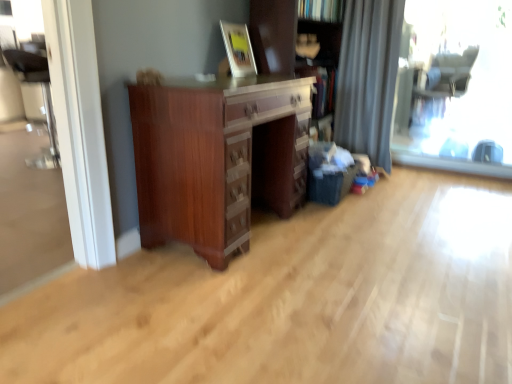
Question: Considering the relative sizes of transparent glass window at right and wooden picture frame at upper center in the image provided, is transparent glass window at right bigger than wooden picture frame at upper center?

Choices:
 (A) no
 (B) yes

Answer: (B)

Question: Are transparent glass window at right and wooden picture frame at upper center located far from each other?

Choices:
 (A) yes
 (B) no

Answer: (A)

Question: Can you confirm if transparent glass window at right is positioned to the right of wooden picture frame at upper center?

Choices:
 (A) yes
 (B) no

Answer: (A)

Question: From the image's perspective, is transparent glass window at right below wooden picture frame at upper center?

Choices:
 (A) no
 (B) yes

Answer: (B)

Question: Is transparent glass window at right smaller than wooden picture frame at upper center?

Choices:
 (A) yes
 (B) no

Answer: (B)

Question: From a real-world perspective, is transparent glass window at right physically above wooden picture frame at upper center?

Choices:
 (A) yes
 (B) no

Answer: (B)

Question: Is gray fabric curtain at right smaller than transparent glass window at right?

Choices:
 (A) yes
 (B) no

Answer: (B)

Question: Is gray fabric curtain at right facing towards transparent glass window at right?

Choices:
 (A) no
 (B) yes

Answer: (A)

Question: Is there a large distance between gray fabric curtain at right and transparent glass window at right?

Choices:
 (A) yes
 (B) no

Answer: (A)

Question: Is gray fabric curtain at right closer to camera compared to transparent glass window at right?

Choices:
 (A) yes
 (B) no

Answer: (B)

Question: Does gray fabric curtain at right appear on the right side of transparent glass window at right?

Choices:
 (A) no
 (B) yes

Answer: (A)

Question: Is gray fabric curtain at right at the left side of transparent glass window at right?

Choices:
 (A) no
 (B) yes

Answer: (B)

Question: From the image's perspective, is mahogany wood chest of drawers at center beneath wooden bookcase at center?

Choices:
 (A) no
 (B) yes

Answer: (B)